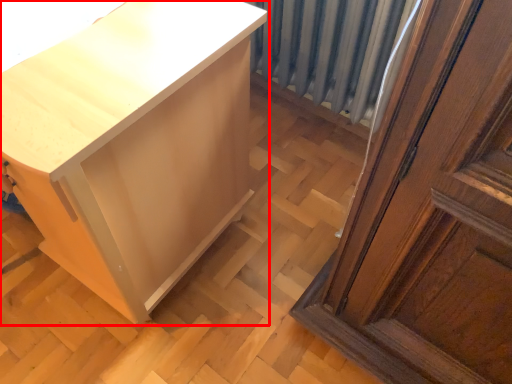
Question: From the image's perspective, considering the relative positions of furniture (annotated by the red box) and radiator in the image provided, where is furniture (annotated by the red box) located with respect to the staircase?

Choices:
 (A) below
 (B) above

Answer: (A)